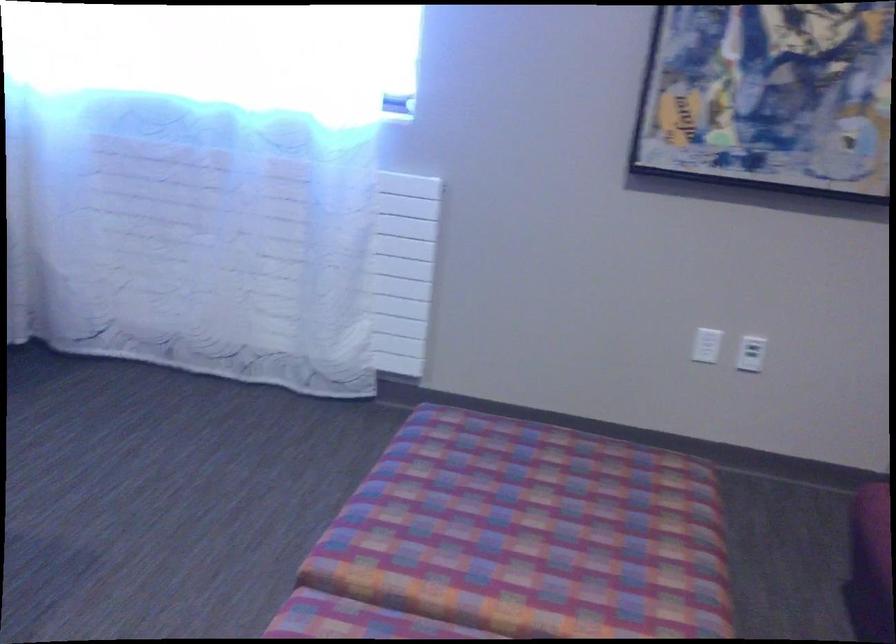
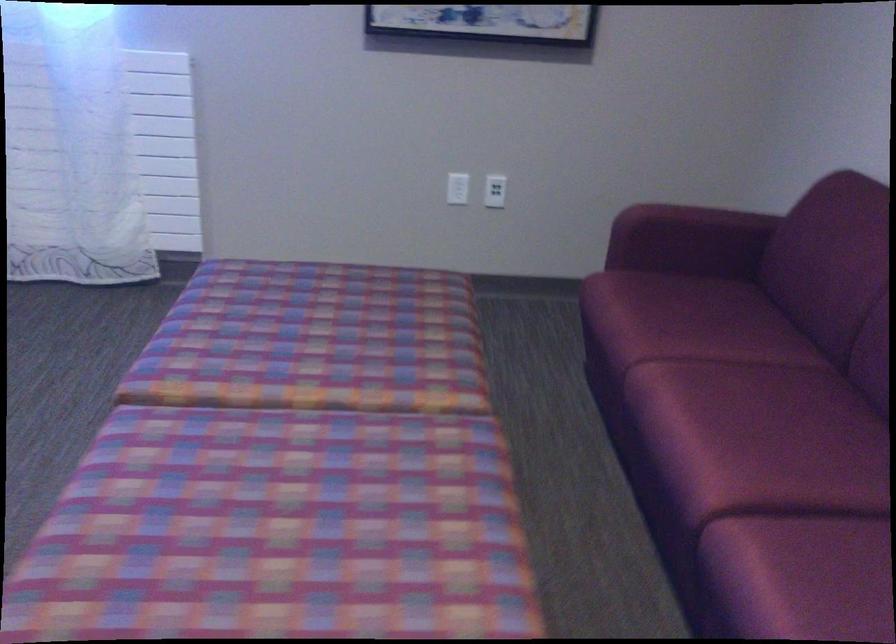
Question: The images are taken continuously from a first-person perspective. In which direction are you moving?

Choices:
 (A) Left
 (B) Right
 (C) Forward
 (D) Backward

Answer: (D)